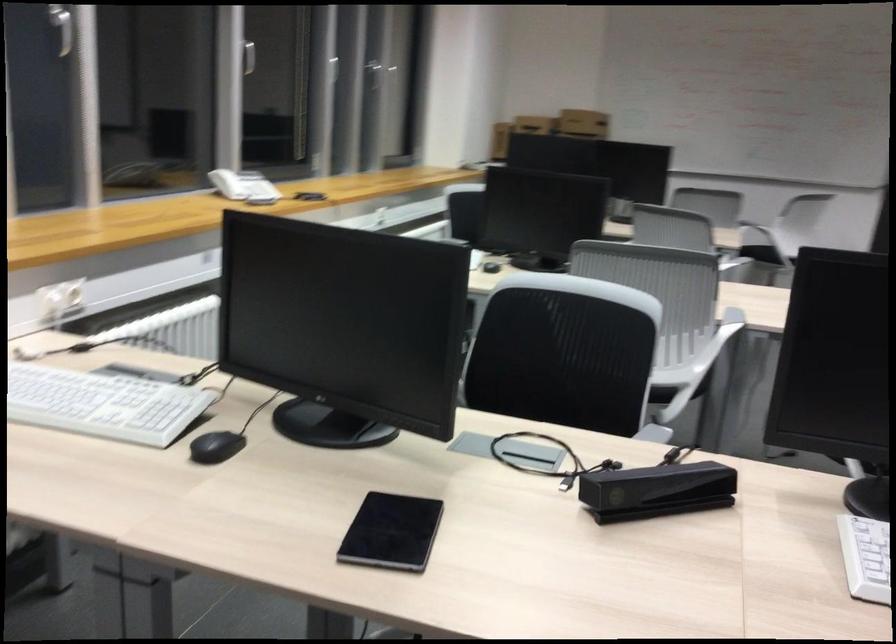
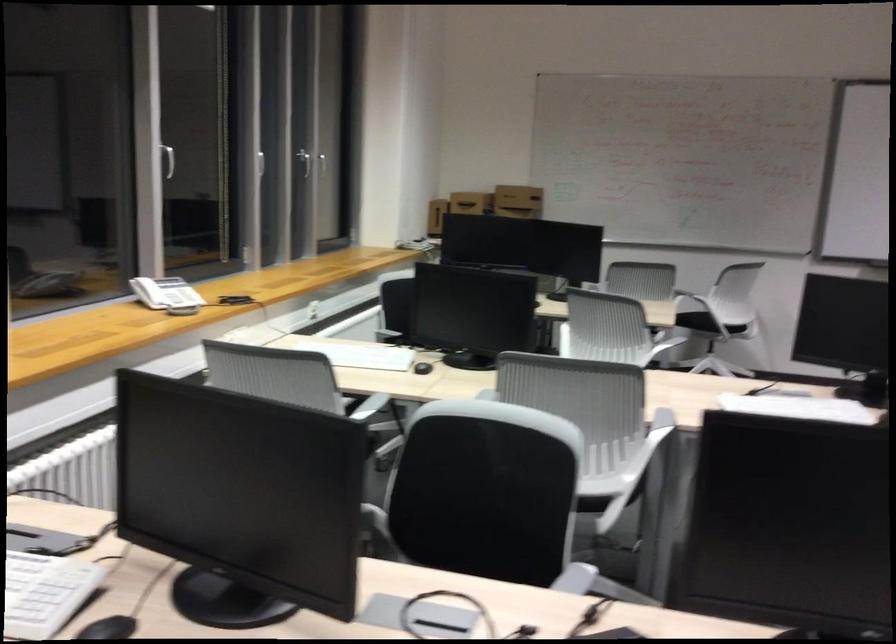
Question: The images are taken continuously from a first-person perspective. In which direction are you moving?

Choices:
 (A) Left
 (B) Right
 (C) Forward
 (D) Backward

Answer: (B)